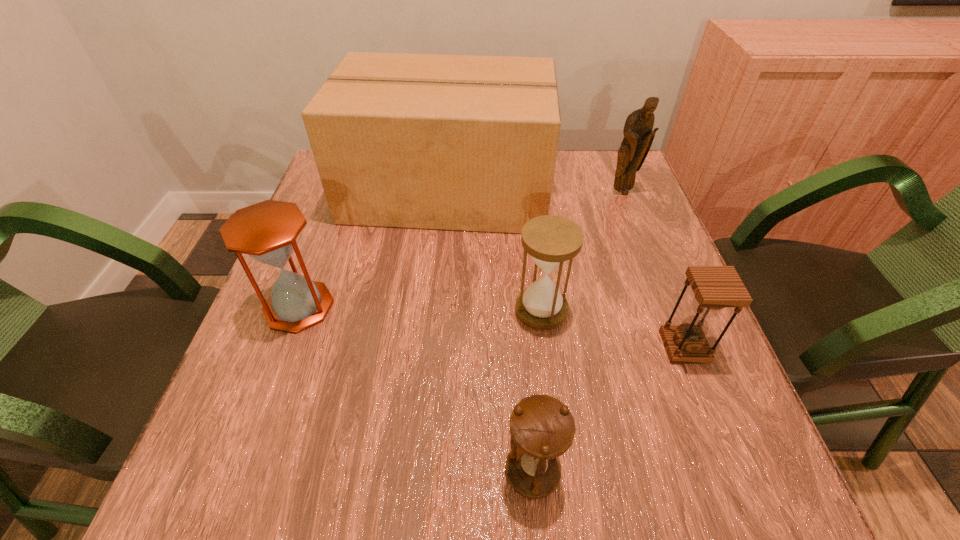
The width and height of the screenshot is (960, 540). I want to click on vacant area at the left edge of the desktop, so click(299, 265).

In the image, there is a desktop. In order to click on vacant region at the right edge in this screenshot , I will do `click(608, 241)`.

This screenshot has height=540, width=960. Identify the location of free spot between the box and the rightmost hourglass. (565, 268).

Image resolution: width=960 pixels, height=540 pixels. What are the coordinates of `unoccupied position between the leftmost hourglass and the rightmost hourglass` in the screenshot? It's located at click(x=492, y=327).

Locate an element on the screen. free spot between the leftmost hourglass and the box is located at coordinates (373, 248).

I want to click on vacant space that is in between the box and the nearest object, so click(x=490, y=331).

Where is `object that is the fourth closest to the nearest hourglass`? This screenshot has height=540, width=960. object that is the fourth closest to the nearest hourglass is located at coordinates (455, 142).

Where is `the third closest object to the figurine`? the third closest object to the figurine is located at coordinates (715, 287).

Choose which hourglass is the second nearest neighbor to the leftmost hourglass. Please provide its 2D coordinates. Your answer should be formatted as a tuple, i.e. [(x, y)], where the tuple contains the x and y coordinates of a point satisfying the conditions above.

[(542, 428)]

The image size is (960, 540). I want to click on hourglass that stands as the closest to the rightmost hourglass, so click(550, 240).